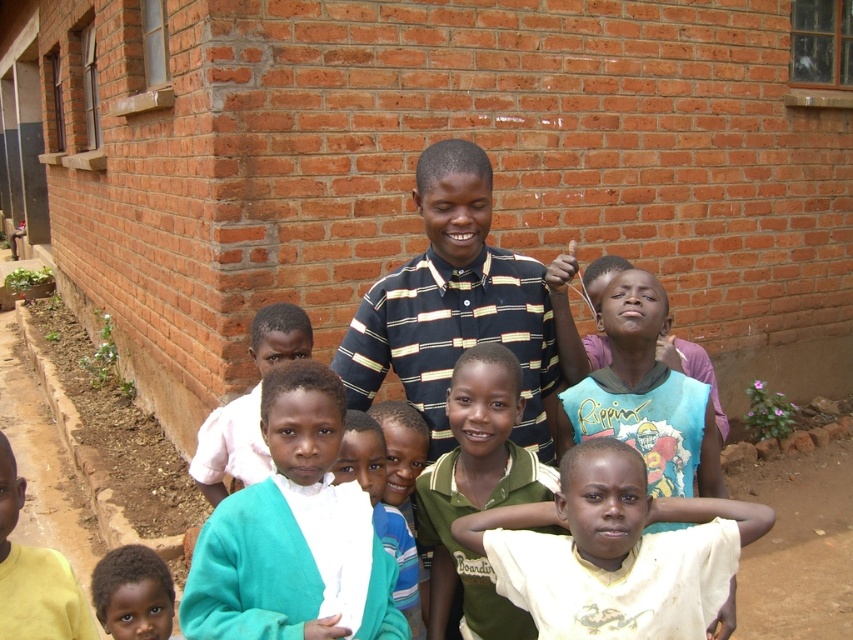
This screenshot has width=853, height=640. Describe the element at coordinates (477, 490) in the screenshot. I see `green jersey at center` at that location.

Between point (509, 502) and point (230, 454), which one is positioned behind?

Point (230, 454)

What are the coordinates of `green jersey at center` in the screenshot? It's located at (477, 490).

Does white matte shirt at lower center appear over dark brown skin at lower left?

Indeed, white matte shirt at lower center is positioned over dark brown skin at lower left.

Which is above, white matte shirt at lower center or dark brown skin at lower left?

white matte shirt at lower center is above.

Between point (724, 538) and point (141, 632), which one is positioned behind?

The point (141, 632) is more distant.

Where is `white matte shirt at lower center`? The width and height of the screenshot is (853, 640). white matte shirt at lower center is located at coordinates (614, 552).

Does white matte shirt at lower center appear over teal fabric shirt at center?

No.

Does white matte shirt at lower center have a greater height compared to teal fabric shirt at center?

Incorrect, white matte shirt at lower center's height is not larger of teal fabric shirt at center's.

Locate an element on the screen. Image resolution: width=853 pixels, height=640 pixels. white matte shirt at lower center is located at coordinates (614, 552).

The height and width of the screenshot is (640, 853). What are the coordinates of `white matte shirt at lower center` in the screenshot? It's located at (614, 552).